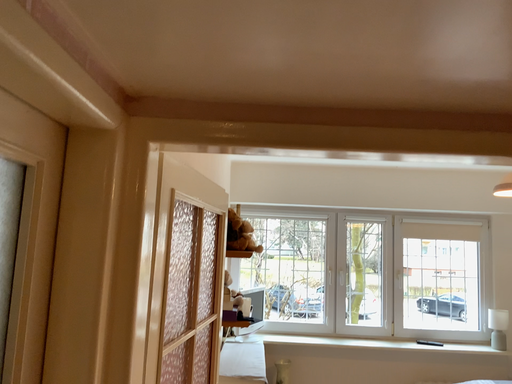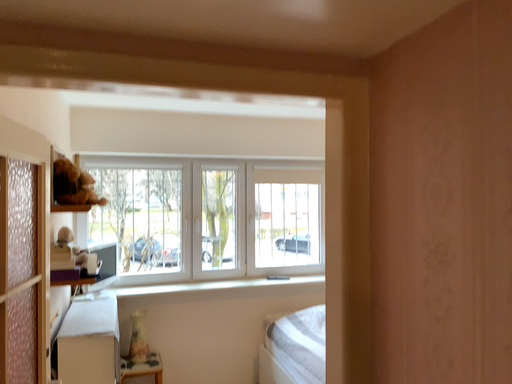
Question: Which way did the camera rotate in the video?

Choices:
 (A) rotated left
 (B) rotated right

Answer: (B)